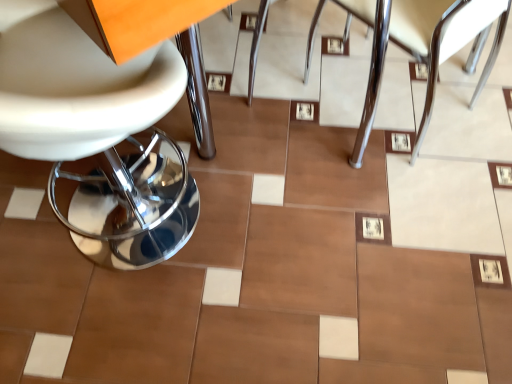
At what (x,y) coordinates should I click in order to perform the action: click on vacant area located to the right-hand side of white leather chair at left, the 1th chair from the left. Please return your answer as a coordinate pair (x, y). This screenshot has height=384, width=512. Looking at the image, I should click on (283, 269).